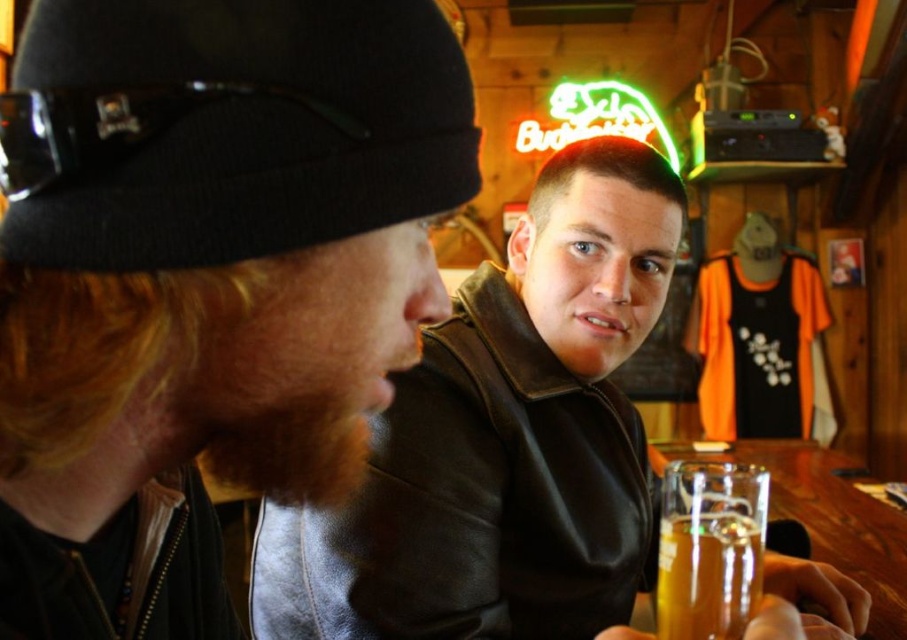
You are a photographer trying to capture a closeup of both the leather jacket at left and the black knit cap at upper left in the scene. Since you want both items to appear the same size in the photo, which object should you move closer to the camera and which should you move farther away?

To make both the leather jacket at left and the black knit cap at upper left appear the same size in the photo, you should move the smaller black knit cap at upper left closer to the camera and move the larger leather jacket at left farther away. This adjustment balances their apparent sizes based on their actual sizes and distances from the camera.

You are a fashion designer observing the two individuals in the scene. You need to determine which item, the leather jacket at left or the black knit cap at upper left, would require more fabric to produce. Based on the scene description, which item has a greater width and thus would need more material?

The leather jacket at left has a greater width than the black knit cap at upper left, so it would require more fabric to produce.

You are standing in front of the wooden table at the bar. You need to place a new glass exactly where the leather jacket at center is located. Is this possible?

The leather jacket at center is located at point (504, 438), so placing a glass there would require removing the jacket first since it occupies that space.